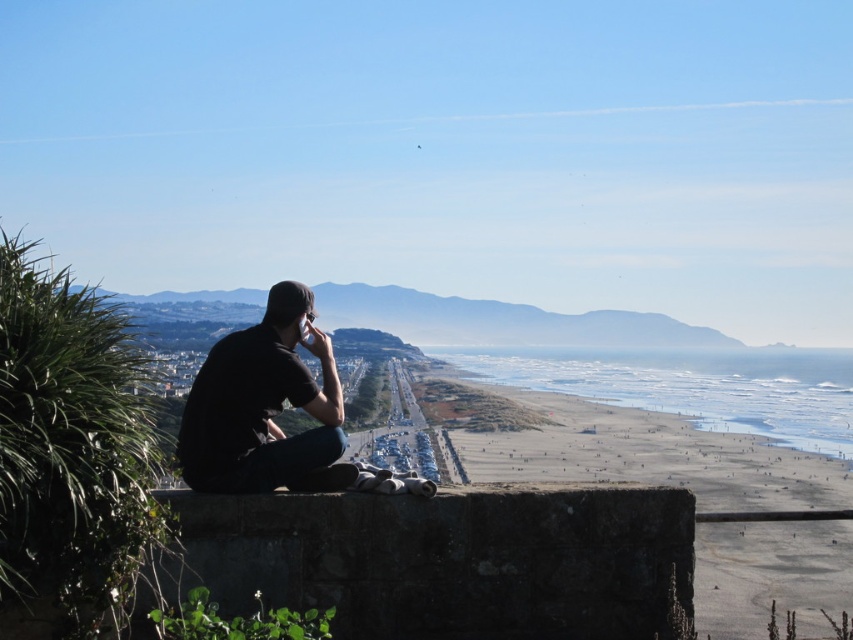
Question: Among these objects, which one is nearest to the camera?

Choices:
 (A) black matte shirt at left
 (B) smooth sand beach at center

Answer: (A)

Question: Which point is closer to the camera?

Choices:
 (A) black matte shirt at left
 (B) smooth sand beach at center

Answer: (A)

Question: Can you confirm if smooth sand beach at center is smaller than black matte shirt at left?

Choices:
 (A) no
 (B) yes

Answer: (A)

Question: Which point is farther to the camera?

Choices:
 (A) smooth sand beach at center
 (B) black matte shirt at left

Answer: (A)

Question: Is smooth sand beach at center above black matte shirt at left?

Choices:
 (A) yes
 (B) no

Answer: (B)

Question: Is the position of smooth sand beach at center less distant than that of black matte shirt at left?

Choices:
 (A) no
 (B) yes

Answer: (A)